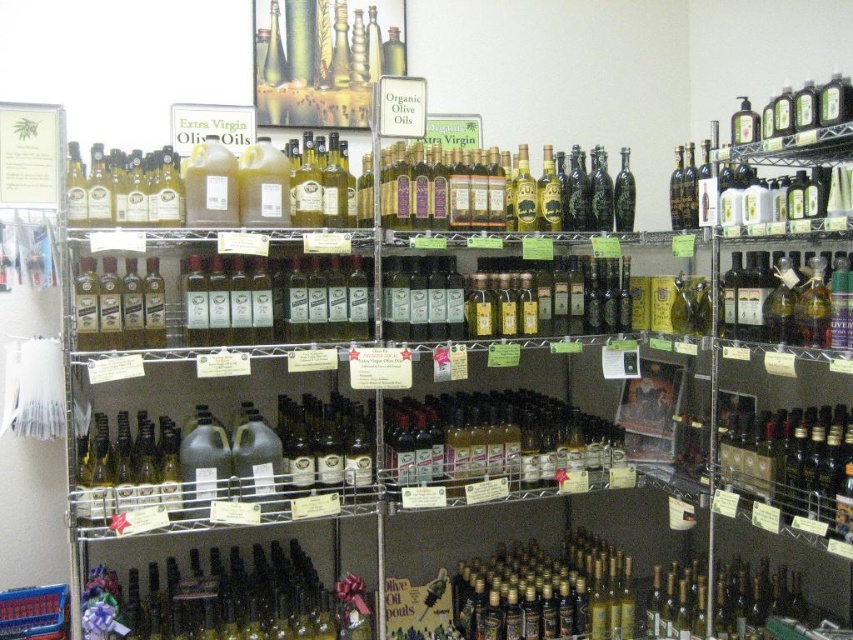
Consider the image. You are a customer in a store looking at the olive oil display. You see the point labeled as point (x=231, y=598). What is located at that point?

The point (x=231, y=598) corresponds to translucent glass bottles at lower center.

You are a customer in the store looking at the shelves. You see the translucent glass bottles at lower center. Where exactly are they located on the shelves?

The translucent glass bottles at lower center are located at the 2D coordinates point (231, 598) on the shelves.